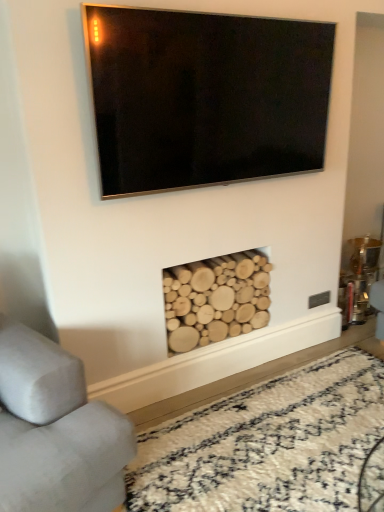
Question: Does natural wood logs at lower center have a lesser height compared to natural wood logs at lower center?

Choices:
 (A) yes
 (B) no

Answer: (A)

Question: Is natural wood logs at lower center aimed at natural wood logs at lower center?

Choices:
 (A) no
 (B) yes

Answer: (A)

Question: Is natural wood logs at lower center positioned behind natural wood logs at lower center?

Choices:
 (A) yes
 (B) no

Answer: (B)

Question: Considering the relative sizes of natural wood logs at lower center and natural wood logs at lower center in the image provided, is natural wood logs at lower center bigger than natural wood logs at lower center?

Choices:
 (A) yes
 (B) no

Answer: (A)

Question: Can you confirm if natural wood logs at lower center is taller than natural wood logs at lower center?

Choices:
 (A) yes
 (B) no

Answer: (B)

Question: Which is correct: natural wood logs at lower center is inside matte black tv at upper center, or outside of it?

Choices:
 (A) outside
 (B) inside

Answer: (A)

Question: From their relative heights in the image, would you say natural wood logs at lower center is taller or shorter than matte black tv at upper center?

Choices:
 (A) short
 (B) tall

Answer: (A)

Question: In the image, is natural wood logs at lower center positioned in front of or behind matte black tv at upper center?

Choices:
 (A) front
 (B) behind

Answer: (B)

Question: Based on their sizes in the image, would you say natural wood logs at lower center is bigger or smaller than matte black tv at upper center?

Choices:
 (A) big
 (B) small

Answer: (A)

Question: Would you say natural wood logs at lower center is to the left or to the right of gray fabric couch at lower left in the picture?

Choices:
 (A) right
 (B) left

Answer: (A)

Question: Considering their positions, is natural wood logs at lower center located in front of or behind gray fabric couch at lower left?

Choices:
 (A) behind
 (B) front

Answer: (A)

Question: From a real-world perspective, is natural wood logs at lower center physically located above or below gray fabric couch at lower left?

Choices:
 (A) above
 (B) below

Answer: (B)

Question: Is natural wood logs at lower center wider or thinner than gray fabric couch at lower left?

Choices:
 (A) wide
 (B) thin

Answer: (B)

Question: Is matte black tv at upper center wider or thinner than natural wood logs at lower center?

Choices:
 (A) wide
 (B) thin

Answer: (B)

Question: From a real-world perspective, is matte black tv at upper center positioned above or below natural wood logs at lower center?

Choices:
 (A) above
 (B) below

Answer: (A)